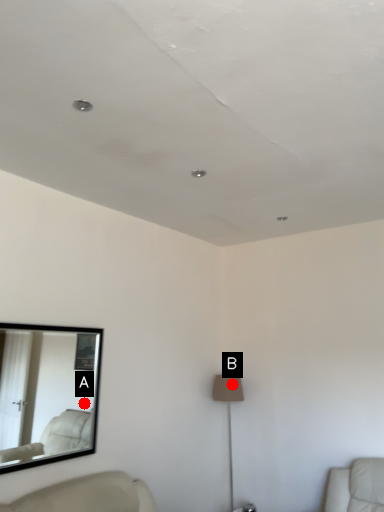
Question: Two points are circled on the image, labeled by A and B beside each circle. Which point is farther from the camera taking this photo?

Choices:
 (A) A is further
 (B) B is further

Answer: (B)